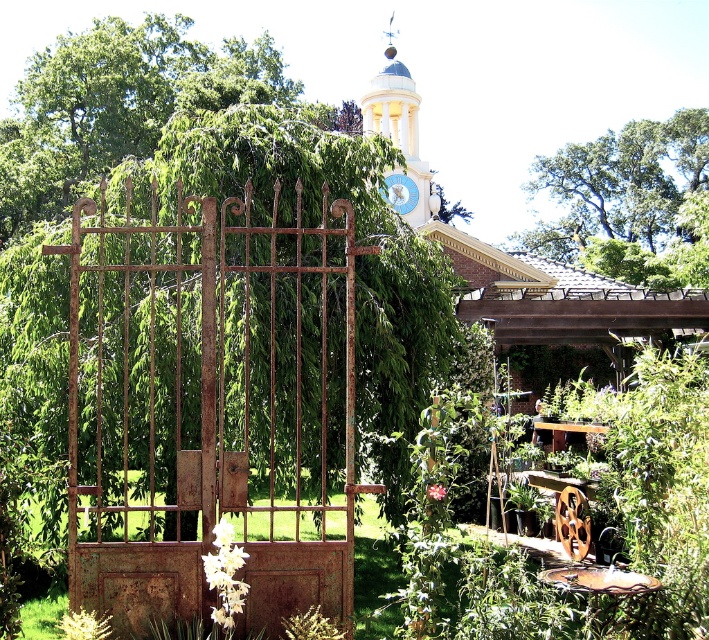
Who is taller, rusty metal gate at center or white painted stone clock tower at upper center?

white painted stone clock tower at upper center is taller.

Image resolution: width=709 pixels, height=640 pixels. Describe the element at coordinates (211, 404) in the screenshot. I see `rusty metal gate at center` at that location.

Where is `rusty metal gate at center`? This screenshot has width=709, height=640. rusty metal gate at center is located at coordinates (211, 404).

Can you confirm if rusty metal gate at center is positioned above rusty metal gate at left?

Correct, rusty metal gate at center is located above rusty metal gate at left.

Measure the distance between rusty metal gate at center and camera.

37.43 feet

The image size is (709, 640). What are the coordinates of `rusty metal gate at center` in the screenshot? It's located at (211, 404).

Measure the distance from rusty metal gate at center to metallic clock at center.

A distance of 7.48 meters exists between rusty metal gate at center and metallic clock at center.

This screenshot has width=709, height=640. In order to click on rusty metal gate at center in this screenshot , I will do `click(211, 404)`.